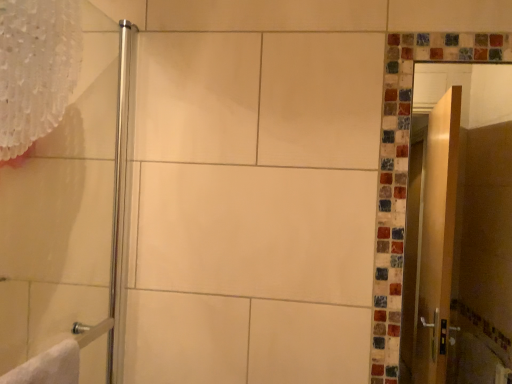
Question: Can you see wooden screen door at right touching white lace curtain at upper left?

Choices:
 (A) yes
 (B) no

Answer: (B)

Question: Could you tell me if wooden screen door at right is facing white lace curtain at upper left?

Choices:
 (A) yes
 (B) no

Answer: (B)

Question: Is wooden screen door at right at the left side of white lace curtain at upper left?

Choices:
 (A) yes
 (B) no

Answer: (B)

Question: Is white lace curtain at upper left at the back of wooden screen door at right?

Choices:
 (A) yes
 (B) no

Answer: (B)

Question: Does wooden screen door at right have a lesser width compared to white lace curtain at upper left?

Choices:
 (A) no
 (B) yes

Answer: (B)

Question: Considering the relative sizes of wooden screen door at right and white lace curtain at upper left in the image provided, is wooden screen door at right shorter than white lace curtain at upper left?

Choices:
 (A) no
 (B) yes

Answer: (A)

Question: Does white lace curtain at upper left have a lesser width compared to polished chrome shower door at left?

Choices:
 (A) yes
 (B) no

Answer: (B)

Question: Considering the relative sizes of white lace curtain at upper left and polished chrome shower door at left in the image provided, is white lace curtain at upper left smaller than polished chrome shower door at left?

Choices:
 (A) yes
 (B) no

Answer: (A)

Question: Considering the relative positions of white lace curtain at upper left and polished chrome shower door at left in the image provided, is white lace curtain at upper left to the left of polished chrome shower door at left from the viewer's perspective?

Choices:
 (A) yes
 (B) no

Answer: (A)

Question: Would you say white lace curtain at upper left is a long distance from polished chrome shower door at left?

Choices:
 (A) yes
 (B) no

Answer: (B)

Question: From a real-world perspective, is white lace curtain at upper left beneath polished chrome shower door at left?

Choices:
 (A) no
 (B) yes

Answer: (A)

Question: Is white lace curtain at upper left further to camera compared to polished chrome shower door at left?

Choices:
 (A) yes
 (B) no

Answer: (A)

Question: Does polished chrome shower door at left touch wooden screen door at right?

Choices:
 (A) yes
 (B) no

Answer: (B)